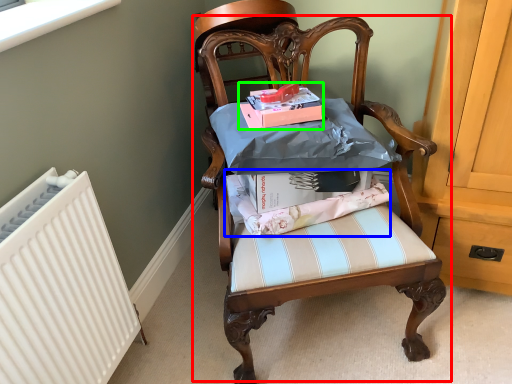
Question: Based on their relative distances, which object is farther from chair (highlighted by a red box)? Choose from fabric (highlighted by a blue box) and magazine (highlighted by a green box).

Choices:
 (A) fabric
 (B) magazine

Answer: (B)